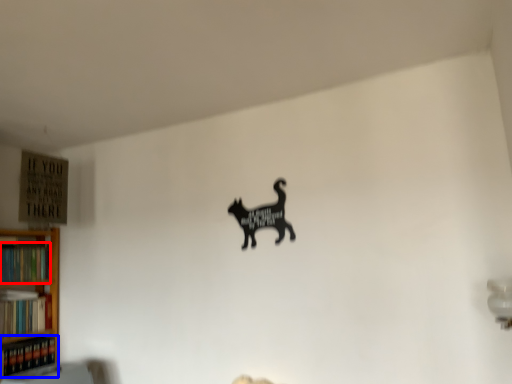
Question: Which object is further to the camera taking this photo, book (highlighted by a red box) or book (highlighted by a blue box)?

Choices:
 (A) book
 (B) book

Answer: (A)